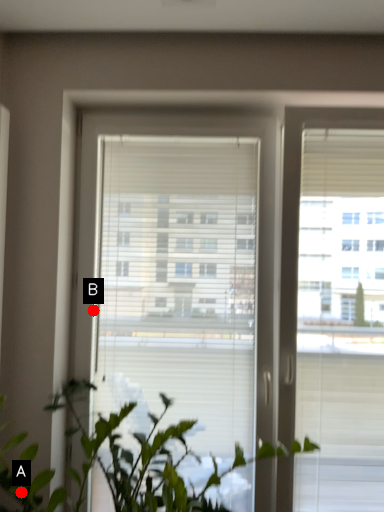
Question: Two points are circled on the image, labeled by A and B beside each circle. Among these points, which one is farthest from the camera?

Choices:
 (A) A is further
 (B) B is further

Answer: (B)